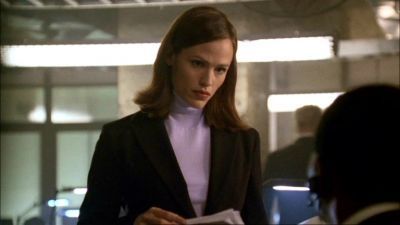
Locate an element on the screen. Image resolution: width=400 pixels, height=225 pixels. stack of papers is located at coordinates (215, 217).